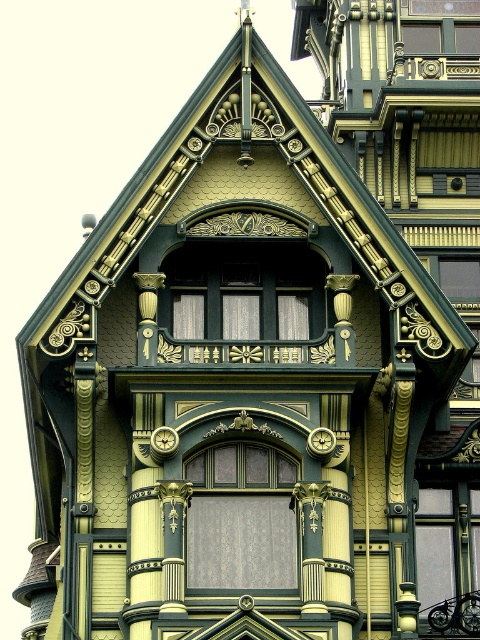
Who is positioned more to the left, matte black window at center or green painted wood column at center?

From the viewer's perspective, green painted wood column at center appears more on the left side.

The image size is (480, 640). In order to click on matte black window at center in this screenshot , I will do `click(243, 291)`.

Identify the location of matte black window at center. The image size is (480, 640). click(243, 291).

Is point (172, 298) in front of point (444, 573)?

That is True.

Is matte black window at center bigger than clear glass window at center?

Correct, matte black window at center is larger in size than clear glass window at center.

You are a GUI agent. You are given a task and a screenshot of the screen. Output one action in this format:
    pyautogui.click(x=<x>, y=<y>)
    Task: Click on the matte black window at center
    This screenshot has width=480, height=640.
    Given the screenshot: What is the action you would take?
    pyautogui.click(x=243, y=291)

Can you confirm if matte glass window at center is smaller than matte black window at center?

Yes, matte glass window at center is smaller than matte black window at center.

Who is higher up, matte glass window at center or matte black window at center?

Positioned higher is matte black window at center.

This screenshot has height=640, width=480. Describe the element at coordinates (240, 516) in the screenshot. I see `matte glass window at center` at that location.

This screenshot has width=480, height=640. I want to click on matte glass window at center, so click(240, 516).